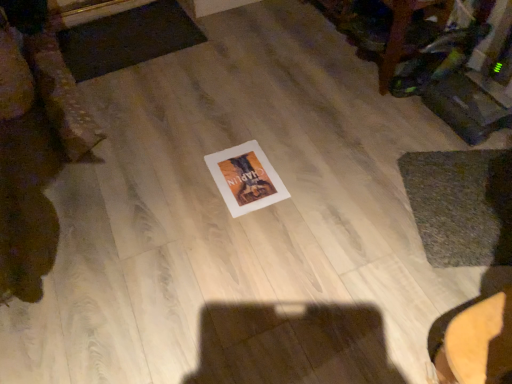
Question: From the image's perspective, is wooden table at upper right located beneath dark gray textured mat at upper left, which is counted as the second mat, starting from the front?

Choices:
 (A) yes
 (B) no

Answer: (B)

Question: Does wooden table at upper right have a lesser height compared to dark gray textured mat at upper left, which appears as the 1th mat when viewed from the top?

Choices:
 (A) no
 (B) yes

Answer: (A)

Question: Does wooden table at upper right appear on the right side of dark gray textured mat at upper left, which is counted as the second mat, starting from the front?

Choices:
 (A) yes
 (B) no

Answer: (A)

Question: Is wooden table at upper right next to dark gray textured mat at upper left, placed as the 2th mat when sorted from bottom to top, and touching it?

Choices:
 (A) yes
 (B) no

Answer: (B)

Question: Considering the relative sizes of wooden table at upper right and dark gray textured mat at upper left, which is the 2th mat in right-to-left order, in the image provided, is wooden table at upper right thinner than dark gray textured mat at upper left, which is the 2th mat in right-to-left order,?

Choices:
 (A) yes
 (B) no

Answer: (A)

Question: Which is correct: green textured mat at lower right, marked as the 1th mat in a bottom-to-top arrangement, is inside wooden table at upper right, or outside of it?

Choices:
 (A) inside
 (B) outside

Answer: (B)

Question: From a real-world perspective, is green textured mat at lower right, the 1th mat in the right-to-left sequence, positioned above or below wooden table at upper right?

Choices:
 (A) below
 (B) above

Answer: (A)

Question: From their relative heights in the image, would you say green textured mat at lower right, the 1th mat in the right-to-left sequence, is taller or shorter than wooden table at upper right?

Choices:
 (A) tall
 (B) short

Answer: (B)

Question: Relative to wooden table at upper right, is green textured mat at lower right, the 1th mat in the right-to-left sequence, in front or behind?

Choices:
 (A) behind
 (B) front

Answer: (B)

Question: Considering their positions, is dark gray textured mat at upper left, placed as the 2th mat when sorted from bottom to top, located in front of or behind white paper at center?

Choices:
 (A) front
 (B) behind

Answer: (B)

Question: Is dark gray textured mat at upper left, which is the 2th mat in right-to-left order, situated inside white paper at center or outside?

Choices:
 (A) inside
 (B) outside

Answer: (B)

Question: Considering the positions of point (98, 34) and point (244, 201), is point (98, 34) closer or farther from the camera than point (244, 201)?

Choices:
 (A) farther
 (B) closer

Answer: (A)

Question: From a real-world perspective, is dark gray textured mat at upper left, which is counted as the second mat, starting from the front, above or below white paper at center?

Choices:
 (A) below
 (B) above

Answer: (B)

Question: Is white paper at center bigger or smaller than wooden table at upper right?

Choices:
 (A) big
 (B) small

Answer: (B)

Question: In terms of width, does white paper at center look wider or thinner when compared to wooden table at upper right?

Choices:
 (A) thin
 (B) wide

Answer: (A)